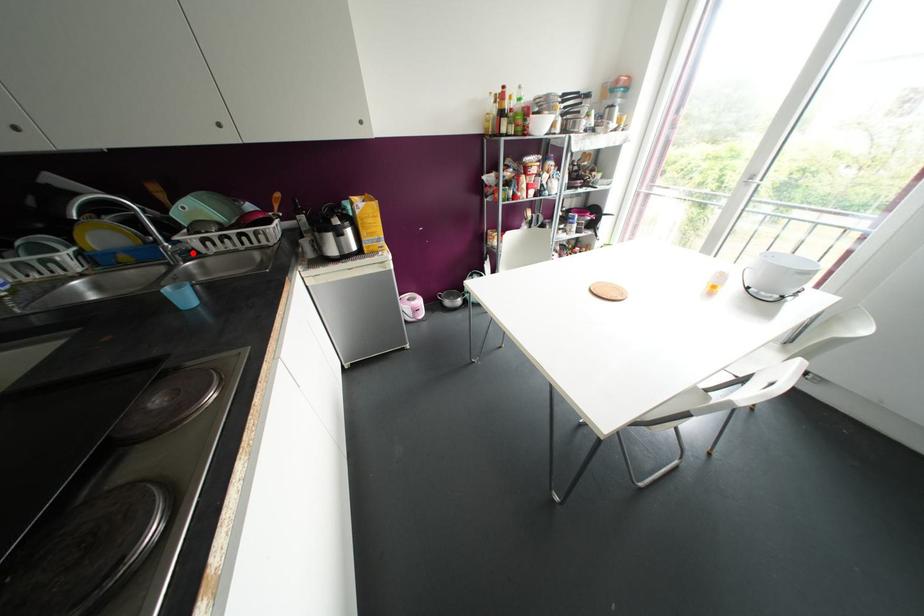
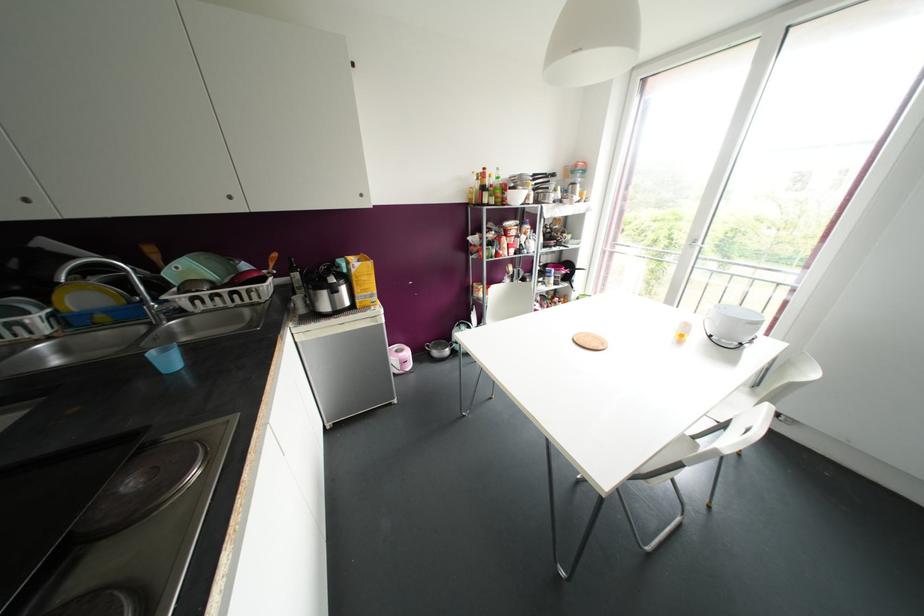
In the second image, find the point that corresponds to the highlighted location in the first image.

(178, 312)